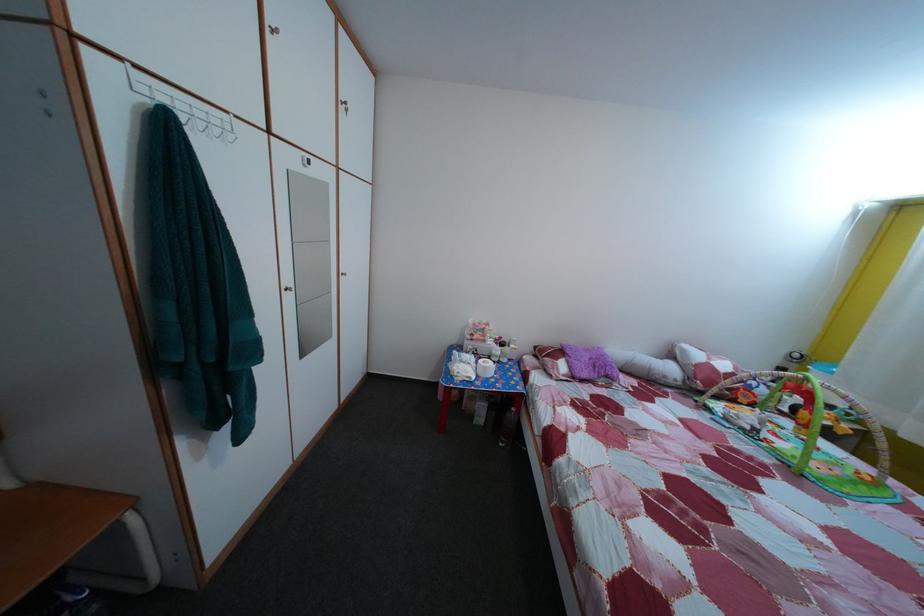
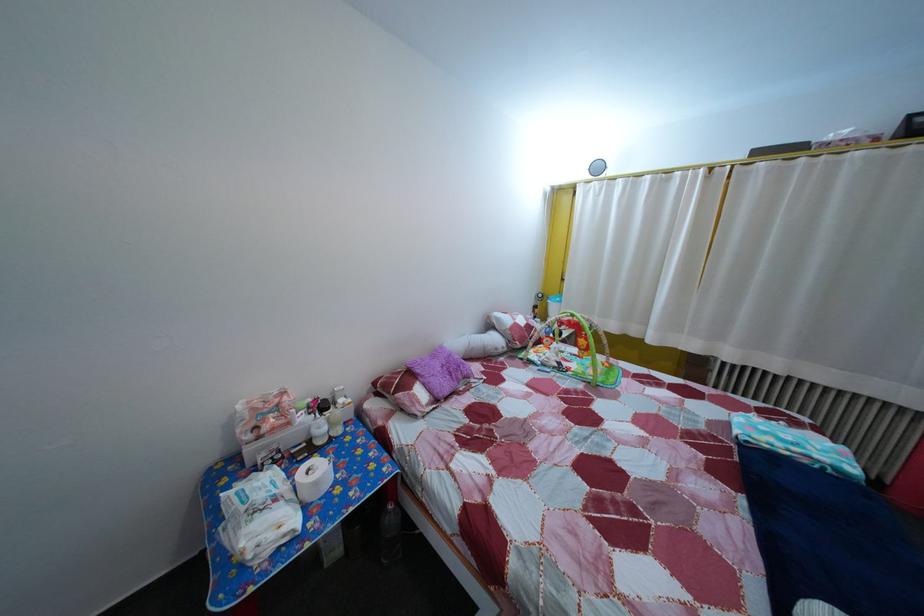
The point at (500, 350) is marked in the first image. Where is the corresponding point in the second image?

(311, 427)